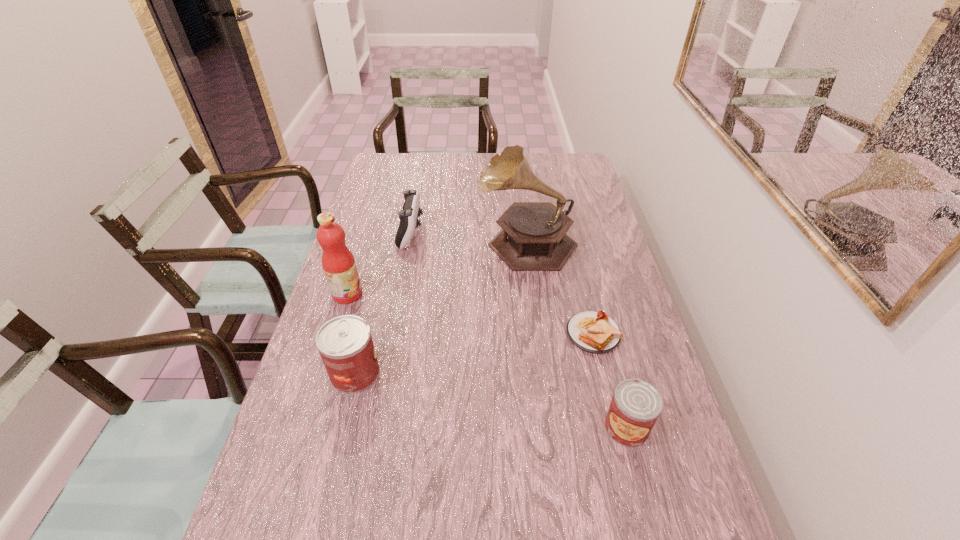
The image size is (960, 540). In order to click on unoccupied area between the sandwich and the phonograph record in this screenshot , I will do 560,287.

Locate an element on the screen. vacant space that is in between the phonograph record and the control is located at coordinates (468, 237).

Locate an element on the screen. free space between the phonograph record and the shortest object is located at coordinates (560, 287).

Identify the location of vacant space in between the phonograph record and the shortest object. The image size is (960, 540). (560, 287).

At what (x,y) coordinates should I click in order to perform the action: click on free area in between the right can and the left can. Please return your answer as a coordinate pair (x, y). Image resolution: width=960 pixels, height=540 pixels. Looking at the image, I should click on (491, 400).

The width and height of the screenshot is (960, 540). I want to click on object that is the closest one to the control, so click(x=338, y=263).

This screenshot has width=960, height=540. I want to click on object that is the closest to the right can, so click(594, 332).

Where is `vacant point that satisfies the following two spatial constraints: 1. on the front label of the third farthest object; 2. on the right side of the sandwich`? The width and height of the screenshot is (960, 540). vacant point that satisfies the following two spatial constraints: 1. on the front label of the third farthest object; 2. on the right side of the sandwich is located at coordinates (335, 334).

Find the location of a particular element. The height and width of the screenshot is (540, 960). free spot that satisfies the following two spatial constraints: 1. on the front-facing side of the control; 2. on the front side of the left can is located at coordinates (385, 373).

Find the location of a particular element. The width and height of the screenshot is (960, 540). blank space that satisfies the following two spatial constraints: 1. on the front-facing side of the control; 2. on the back side of the right can is located at coordinates (375, 427).